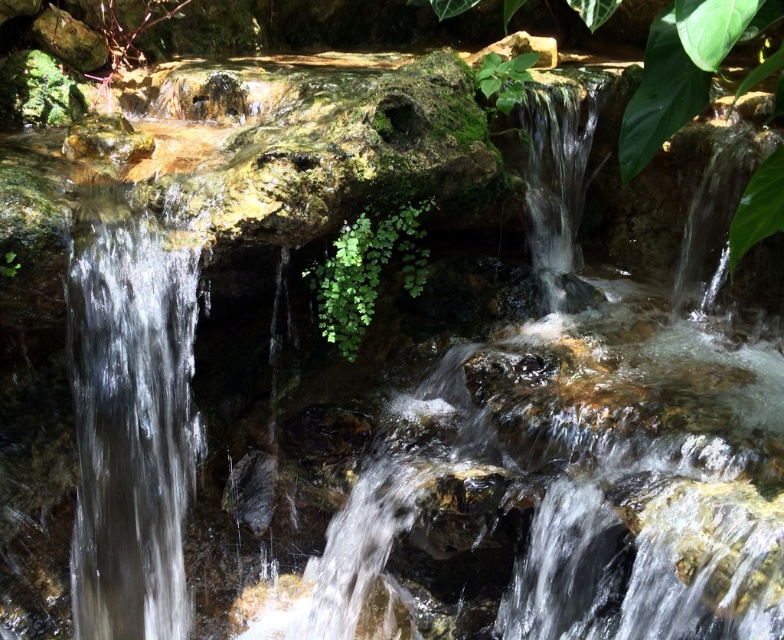
Question: Which point appears farthest from the camera in this image?

Choices:
 (A) (401, 266)
 (B) (111, 353)
 (C) (494, 81)

Answer: (C)

Question: Does clear glass waterfall at left appear over green leafy plant at upper center?

Choices:
 (A) no
 (B) yes

Answer: (A)

Question: Which of these objects is positioned closest to the green leafy plant at center?

Choices:
 (A) green leafy plant at upper center
 (B) clear glass waterfall at left

Answer: (B)

Question: Can you confirm if clear glass waterfall at left is positioned above green leafy plant at center?

Choices:
 (A) no
 (B) yes

Answer: (A)

Question: Can you confirm if clear glass waterfall at left is positioned to the left of green leafy plant at upper center?

Choices:
 (A) yes
 (B) no

Answer: (A)

Question: Among these points, which one is nearest to the camera?

Choices:
 (A) (347, 260)
 (B) (478, 81)

Answer: (A)